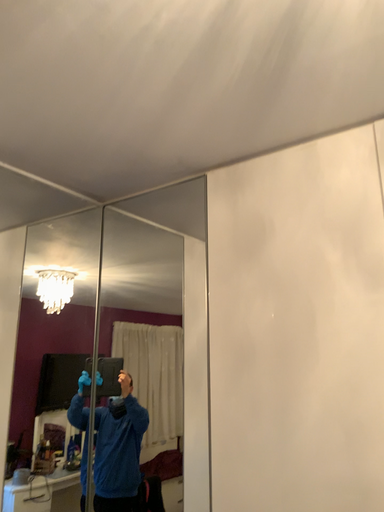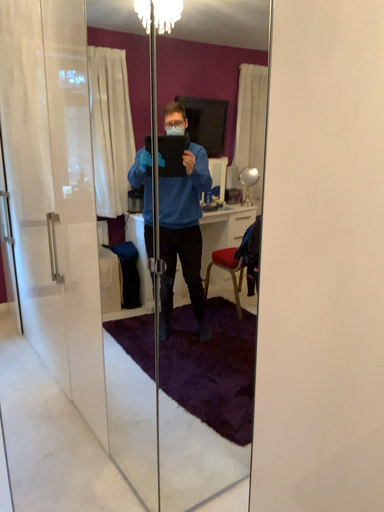
Question: Which way did the camera rotate in the video?

Choices:
 (A) rotated upward
 (B) rotated downward

Answer: (B)